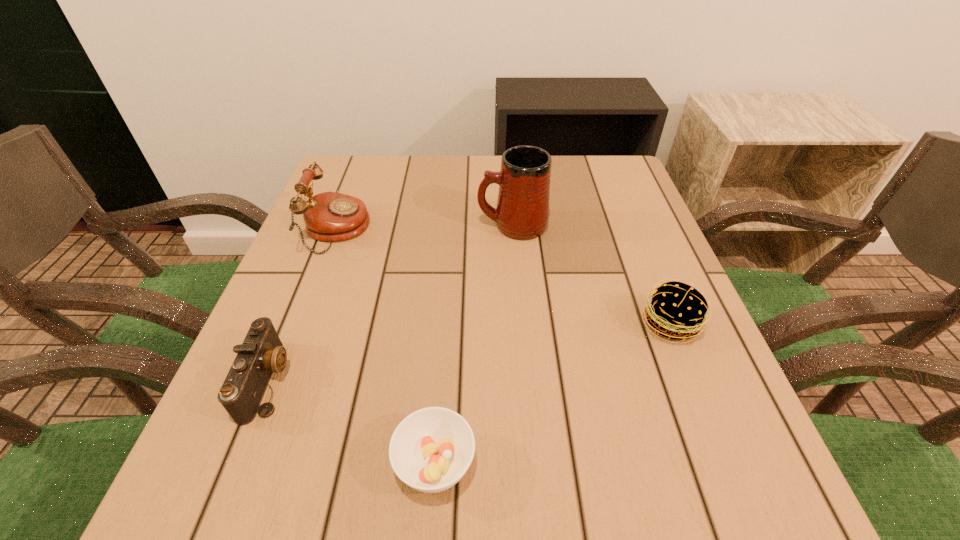
This screenshot has height=540, width=960. I want to click on free spot between the camera and the telephone, so click(x=302, y=305).

Identify the location of free space between the rightmost object and the telephone. (503, 277).

Image resolution: width=960 pixels, height=540 pixels. In order to click on unoccupied position between the camera and the soup bowl in this screenshot , I will do `click(351, 422)`.

Identify the location of vacant area that lies between the fourth shortest object and the rightmost object. The image size is (960, 540). (503, 277).

The height and width of the screenshot is (540, 960). What are the coordinates of `vacant area between the camera and the soup bowl` in the screenshot? It's located at (351, 422).

This screenshot has height=540, width=960. I want to click on vacant space that is in between the rightmost object and the mug, so click(591, 275).

Find the location of a particular element. The height and width of the screenshot is (540, 960). free space between the camera and the rightmost object is located at coordinates (468, 352).

You are a GUI agent. You are given a task and a screenshot of the screen. Output one action in this format:
    pyautogui.click(x=<x>, y=<y>)
    Task: Click on the object that is the fourth closest to the camera
    Image resolution: width=960 pixels, height=540 pixels.
    Given the screenshot: What is the action you would take?
    pyautogui.click(x=677, y=310)

Point out which object is positioned as the third nearest to the tallest object. Please provide its 2D coordinates. Your answer should be formatted as a tuple, i.e. [(x, y)], where the tuple contains the x and y coordinates of a point satisfying the conditions above.

[(261, 353)]

Find the location of a particular element. The image size is (960, 540). free location that satisfies the following two spatial constraints: 1. on the dial of the rightmost object; 2. on the left side of the second tallest object is located at coordinates (300, 325).